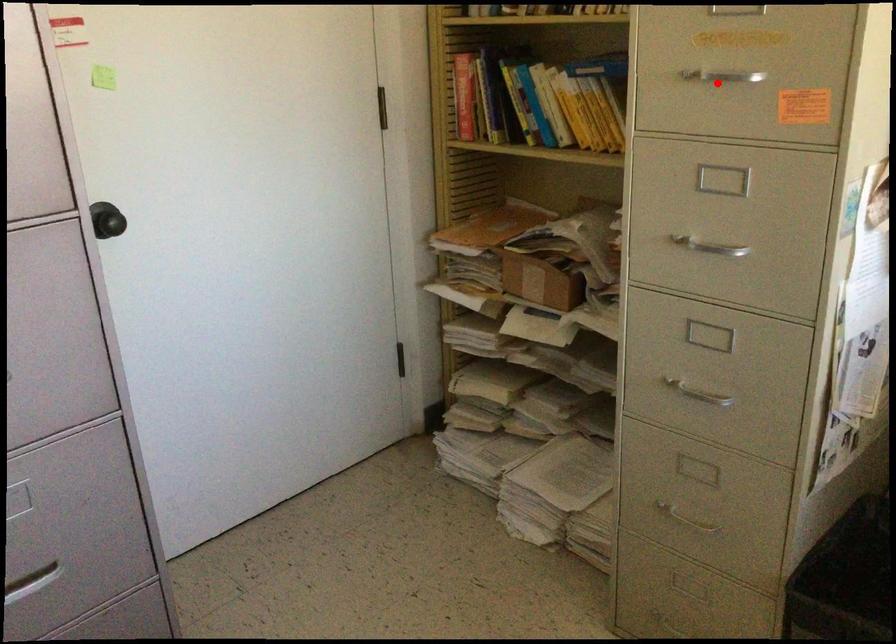
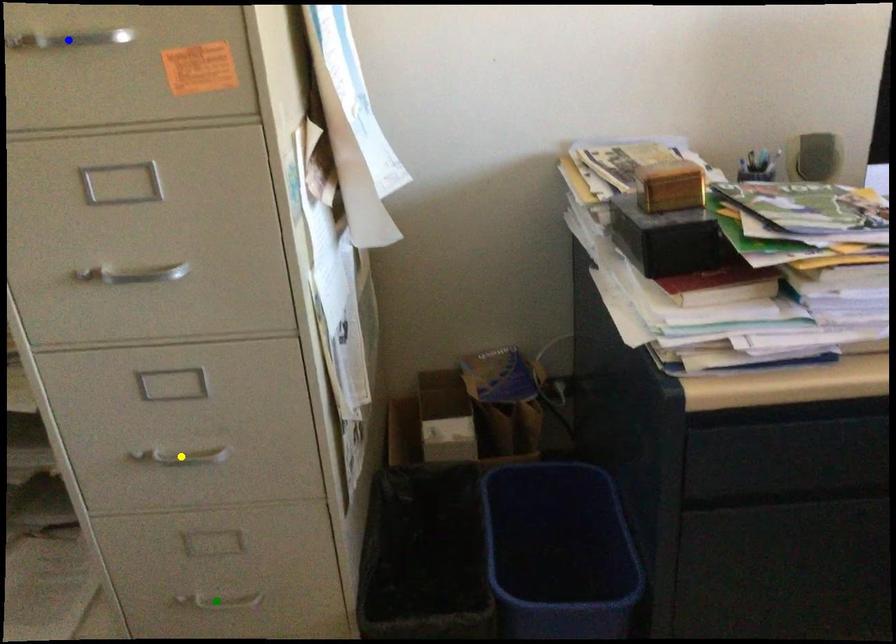
Question: I am providing you with two images of the same scene from different viewpoints. A red point is marked on the first image. You are given multiple points on the second image. Which point in image 2 represents the same 3d spot as the red point in image 1?

Choices:
 (A) blue point
 (B) green point
 (C) yellow point

Answer: (A)